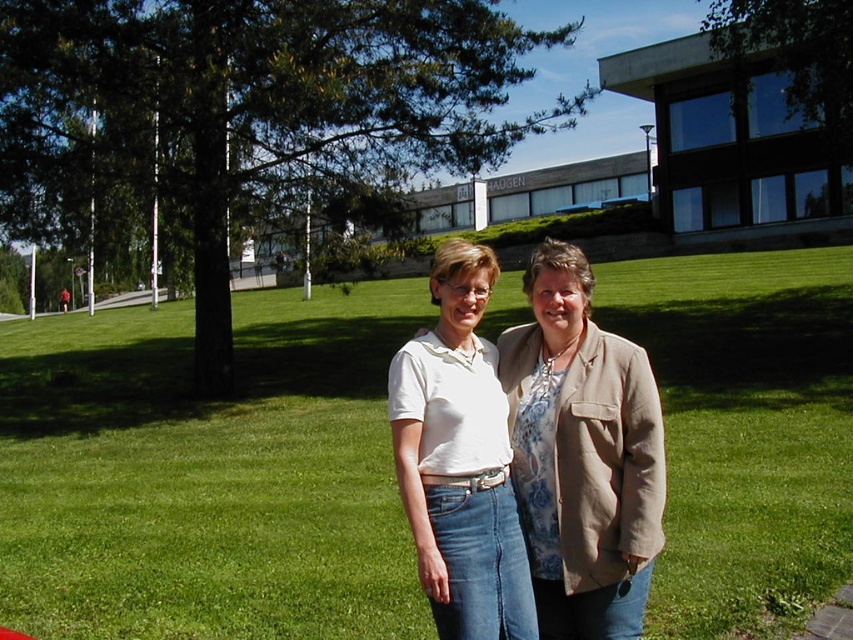
The image size is (853, 640). Identify the location of green grass at center. (207, 476).

I want to click on green grass at center, so coord(207,476).